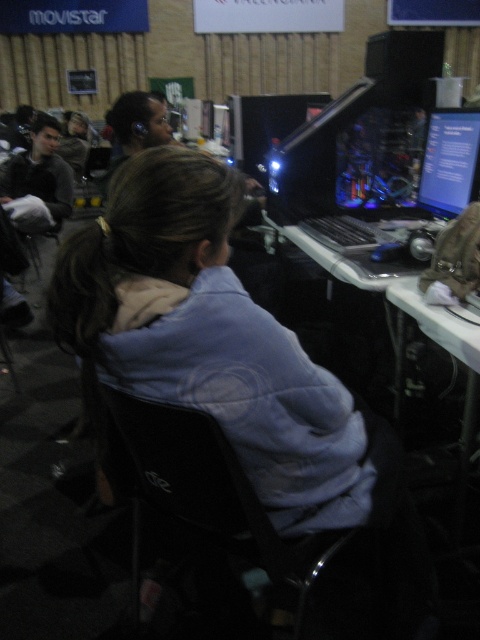
Question: Is light blue fleece at center below matte black monitor at upper right?

Choices:
 (A) no
 (B) yes

Answer: (B)

Question: Does black fabric chair at center appear under matte black monitor at upper right?

Choices:
 (A) no
 (B) yes

Answer: (B)

Question: Is black fabric chair at center closer to the viewer compared to matte black monitor at upper right?

Choices:
 (A) yes
 (B) no

Answer: (A)

Question: Which point is closer to the camera taking this photo?

Choices:
 (A) (155, 388)
 (B) (445, 148)
 (C) (218, 496)

Answer: (A)

Question: Based on their relative distances, which object is nearer to the black fabric chair at center?

Choices:
 (A) matte black monitor at upper right
 (B) light blue fleece at center

Answer: (B)

Question: Which object is positioned closest to the light blue fleece at center?

Choices:
 (A) matte black monitor at upper right
 (B) black fabric chair at center

Answer: (B)